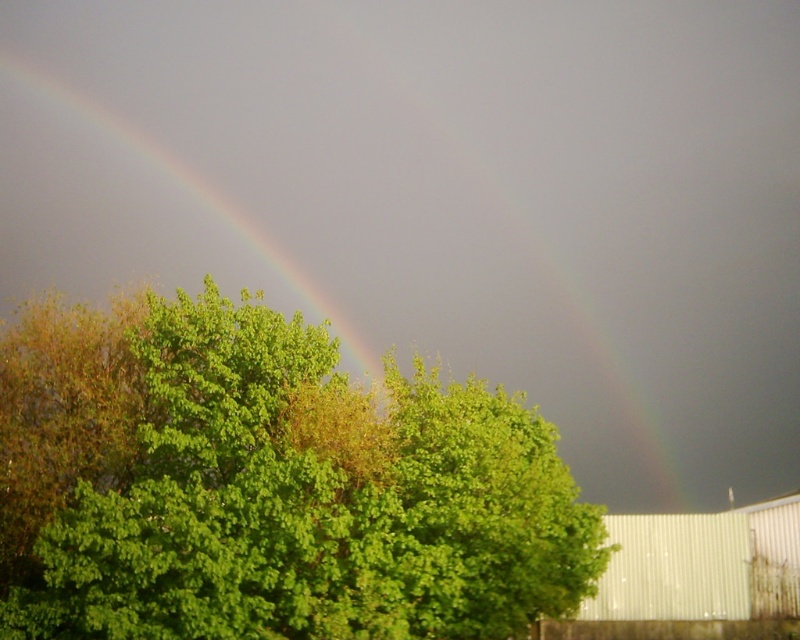
You are an artist painting the scene and want to place the green leafy tree at center and the rainbow at upper left in your canvas. According to the scene, which object should be drawn first to maintain their spatial relationship?

The rainbow at upper left should be drawn first because the green leafy tree at center is positioned on the right side of it, meaning the tree is to the right of the rainbow. By drawing the rainbow first, you can ensure there is space to place the tree to its right while maintaining their correct positions.